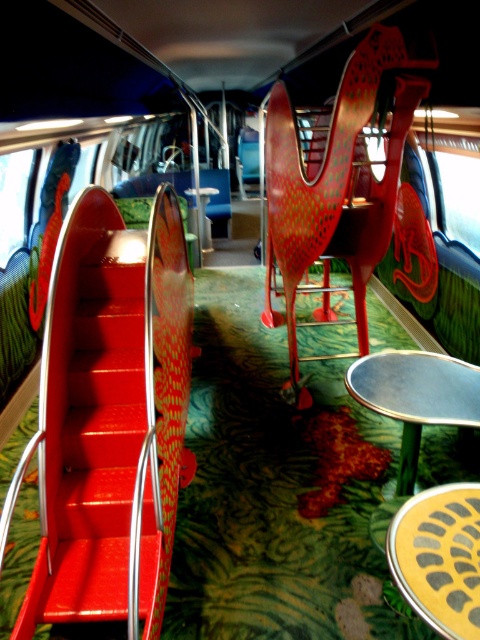
Question: Does shiny red slide at left appear on the left side of metallic red chair at center?

Choices:
 (A) yes
 (B) no

Answer: (A)

Question: Among these objects, which one is farthest from the camera?

Choices:
 (A) shiny red slide at left
 (B) metallic red chair at center

Answer: (B)

Question: Is shiny red slide at left to the right of metallic red chair at center from the viewer's perspective?

Choices:
 (A) yes
 (B) no

Answer: (B)

Question: Is shiny red slide at left closer to camera compared to metallic red chair at center?

Choices:
 (A) no
 (B) yes

Answer: (B)

Question: Which of the following is the farthest from the observer?

Choices:
 (A) (76, 326)
 (B) (283, 96)

Answer: (B)